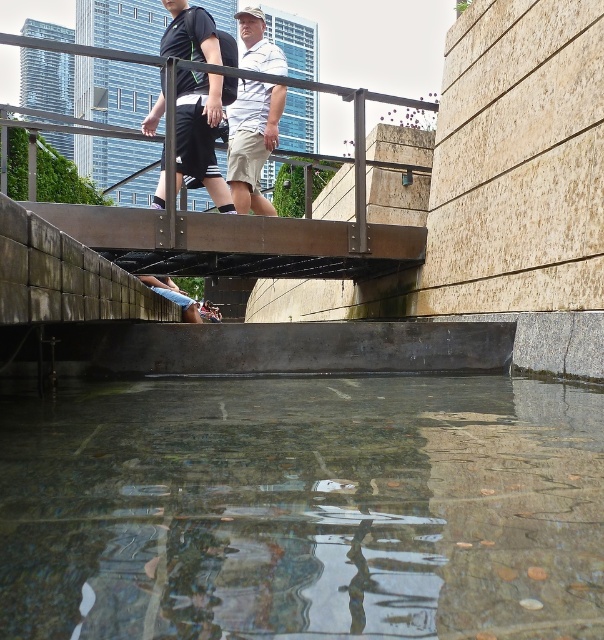
You are a photographer trying to capture the entire scene of the clear glass water at lower center and the white matte shirt at center in one shot. Given that your camera has a fixed focal length, which object should you focus on to ensure both are in frame?

Since the clear glass water at lower center is wider than the white matte shirt at center, you should focus on the clear glass water at lower center to ensure both objects are fully captured in the frame.

You are a photographer trying to capture a photo of the black matte shorts at center and the white matte shirt at center. Which one is on the left side of the other?

The black matte shorts at center is positioned on the left side of white matte shirt at center.